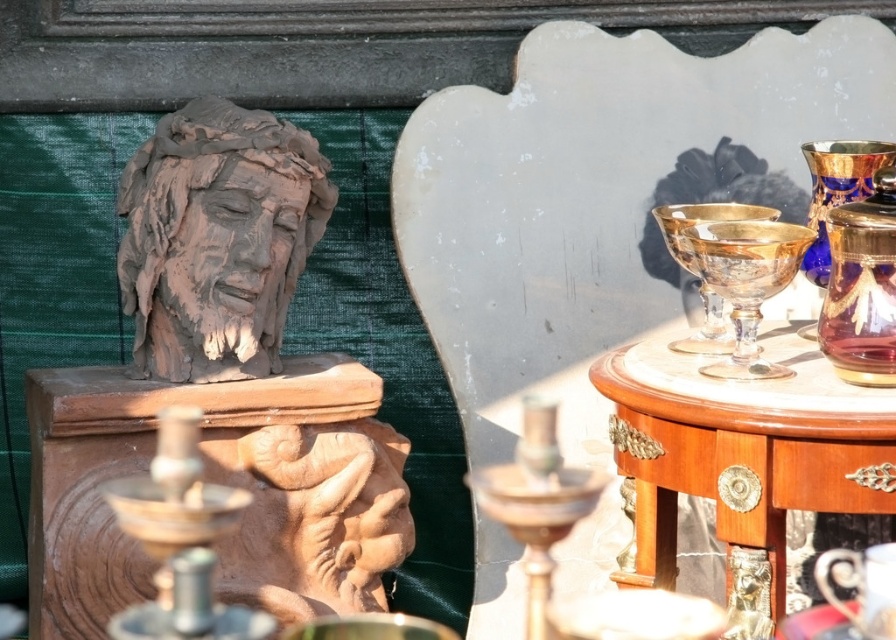
Between clay head at left and gold glass candle holder at right, which one is positioned lower?

Positioned lower is gold glass candle holder at right.

Is clay head at left shorter than gold glass candle holder at right?

No, clay head at left is not shorter than gold glass candle holder at right.

Measure the distance between clay head at left and camera.

A distance of 4.52 meters exists between clay head at left and camera.

Locate an element on the screen. clay head at left is located at coordinates (217, 240).

Can you confirm if wooden polished table at right is bigger than clay head at left?

Yes, wooden polished table at right is bigger than clay head at left.

Between wooden polished table at right and clay head at left, which one appears on the left side from the viewer's perspective?

From the viewer's perspective, clay head at left appears more on the left side.

Is point (685, 397) positioned before point (205, 257)?

Yes, point (685, 397) is closer to viewer.

Where is `wooden polished table at right`? The width and height of the screenshot is (896, 640). wooden polished table at right is located at coordinates (742, 456).

Does clay head at left have a larger size compared to bronze metallic candle holder at lower left?

Actually, clay head at left might be smaller than bronze metallic candle holder at lower left.

Describe the element at coordinates (217, 240) in the screenshot. I see `clay head at left` at that location.

Which is behind, point (296, 131) or point (110, 496)?

Point (296, 131)

At what (x,y) coordinates should I click in order to perform the action: click on clay head at left. Please return your answer as a coordinate pair (x, y). This screenshot has height=640, width=896. Looking at the image, I should click on (217, 240).